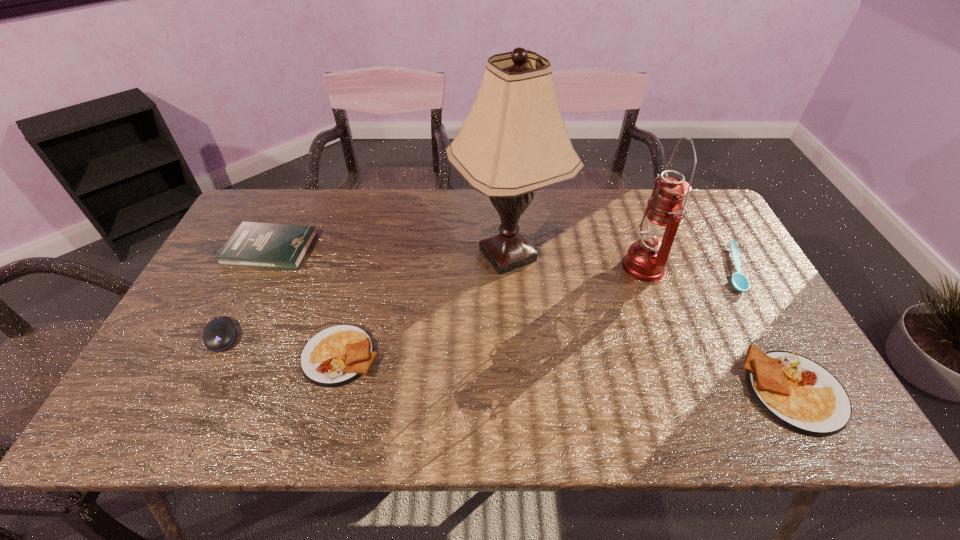
Where is `computer mouse that is at the left edge`? The image size is (960, 540). computer mouse that is at the left edge is located at coordinates (219, 333).

This screenshot has height=540, width=960. In order to click on omelet located at the right edge in this screenshot , I will do `click(796, 392)`.

Image resolution: width=960 pixels, height=540 pixels. In order to click on spoon situated at the right edge in this screenshot , I will do `click(740, 282)`.

This screenshot has height=540, width=960. Find the location of `object that is positioned at the far left corner`. object that is positioned at the far left corner is located at coordinates (262, 245).

I want to click on object present at the near right corner, so click(x=796, y=392).

The image size is (960, 540). What are the coordinates of `blank space at the far edge` in the screenshot? It's located at (564, 193).

Where is `vacant space at the near edge of the desktop`? vacant space at the near edge of the desktop is located at coordinates (479, 382).

This screenshot has width=960, height=540. In the image, there is a desktop. Find the location of `blank space at the left edge`. blank space at the left edge is located at coordinates (180, 329).

At what (x,y) coordinates should I click in order to perform the action: click on free space at the right edge. Please return your answer as a coordinate pair (x, y). Looking at the image, I should click on (714, 258).

Where is `free space at the far left corner of the desktop`? The width and height of the screenshot is (960, 540). free space at the far left corner of the desktop is located at coordinates (276, 206).